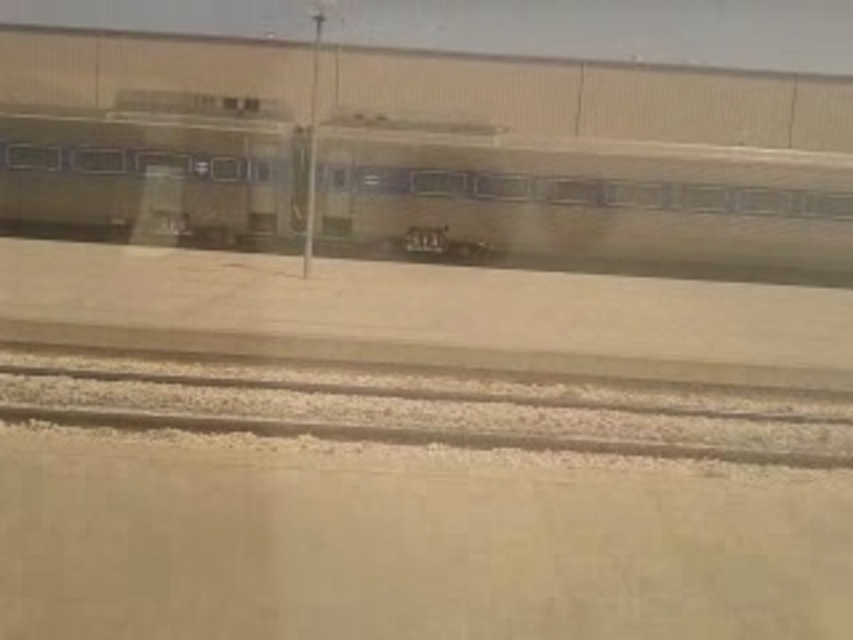
You are a passenger waiting at the station and see the green matte train at center approaching along the gray gravel track at bottom. Can you tell if the train will pass in front of or behind you?

The gray gravel track at bottom is behind the green matte train at center, so the train will pass in front of you.

You are a station engineer who needs to ensure the green matte train at center can fit on the gray gravel track at bottom. Based on the scene, can you confirm if the train will fit on the track?

The green matte train at center is wider than the gray gravel track at bottom, so the train will not fit on the track.